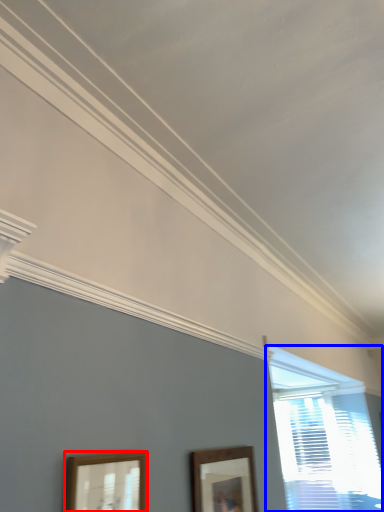
Question: Which object is further to the camera taking this photo, picture frame (highlighted by a red box) or window (highlighted by a blue box)?

Choices:
 (A) picture frame
 (B) window

Answer: (B)